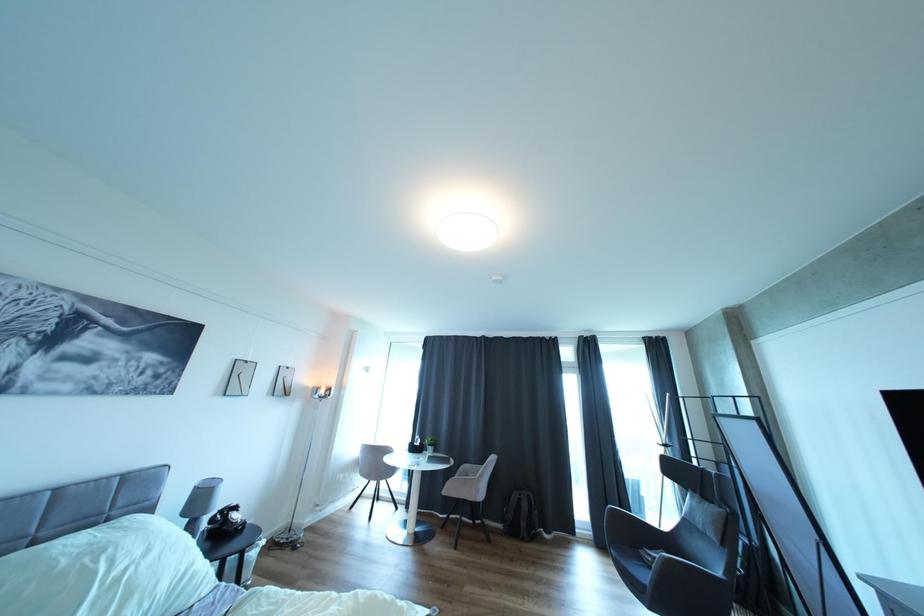
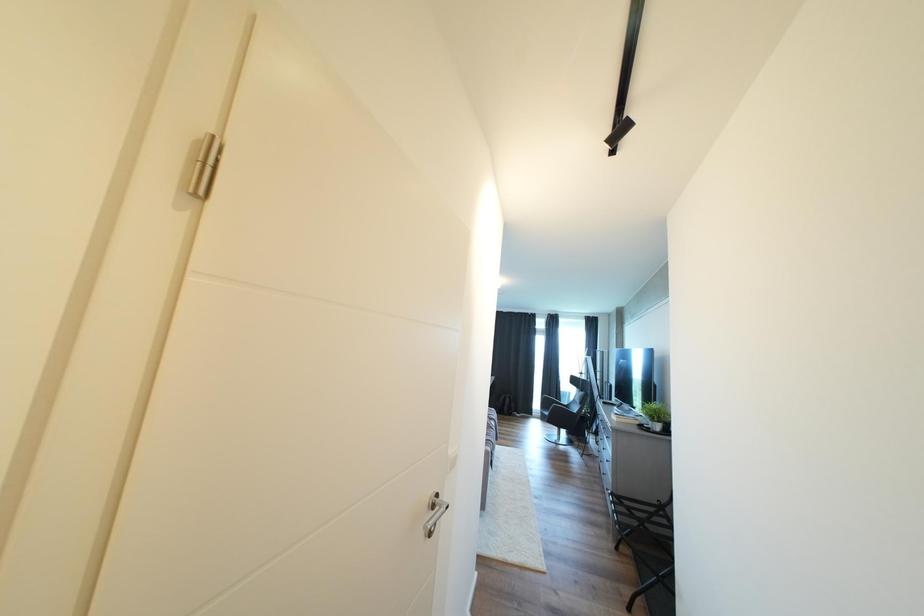
Question: The images are taken continuously from a first-person perspective. In which direction are you moving?

Choices:
 (A) Left
 (B) Right
 (C) Forward
 (D) Backward

Answer: (D)